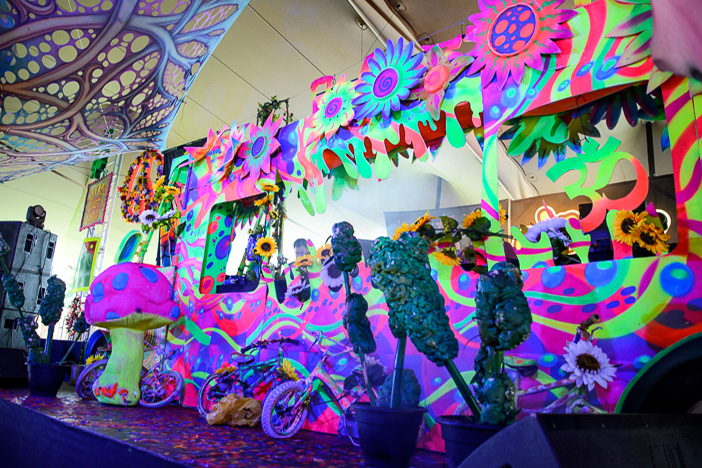
The width and height of the screenshot is (702, 468). I want to click on vase, so click(371, 429), click(467, 436), click(45, 377).